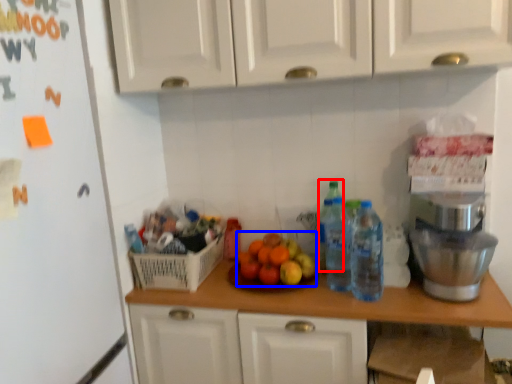
Question: Among these objects, which one is farthest to the camera, bottle (highlighted by a red box) or fruit (highlighted by a blue box)?

Choices:
 (A) bottle
 (B) fruit

Answer: (A)